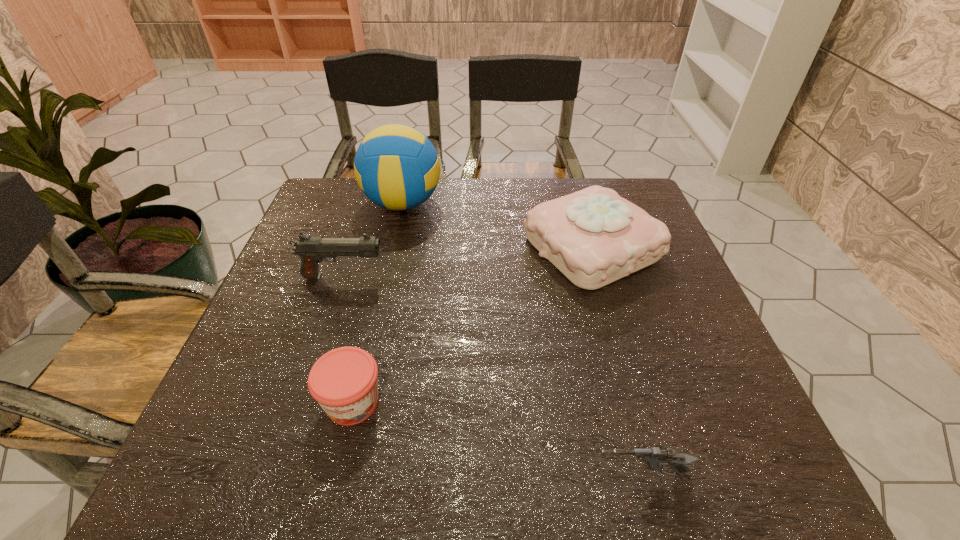
Locate an element on the screen. volleyball is located at coordinates (396, 166).

You are a GUI agent. You are given a task and a screenshot of the screen. Output one action in this format:
    pyautogui.click(x=<x>, y=<y>)
    Task: Click on the left gun
    The height and width of the screenshot is (540, 960).
    Given the screenshot: What is the action you would take?
    pyautogui.click(x=312, y=250)

In order to click on the farther gun in this screenshot , I will do `click(312, 250)`.

The height and width of the screenshot is (540, 960). In order to click on cake in this screenshot , I will do `click(594, 237)`.

Where is `the fourth farthest object`? The height and width of the screenshot is (540, 960). the fourth farthest object is located at coordinates (343, 381).

The image size is (960, 540). In order to click on the second shortest object in this screenshot , I will do (x=343, y=381).

Identify the location of the shortest object. (655, 458).

Locate an element on the screen. This screenshot has height=540, width=960. the nearer gun is located at coordinates (655, 458).

The image size is (960, 540). I want to click on free space located 0.120m on the left of the volleyball, so click(322, 204).

Locate an element on the screen. vacant area located 0.060m in the direction the taller gun is aimed is located at coordinates (411, 276).